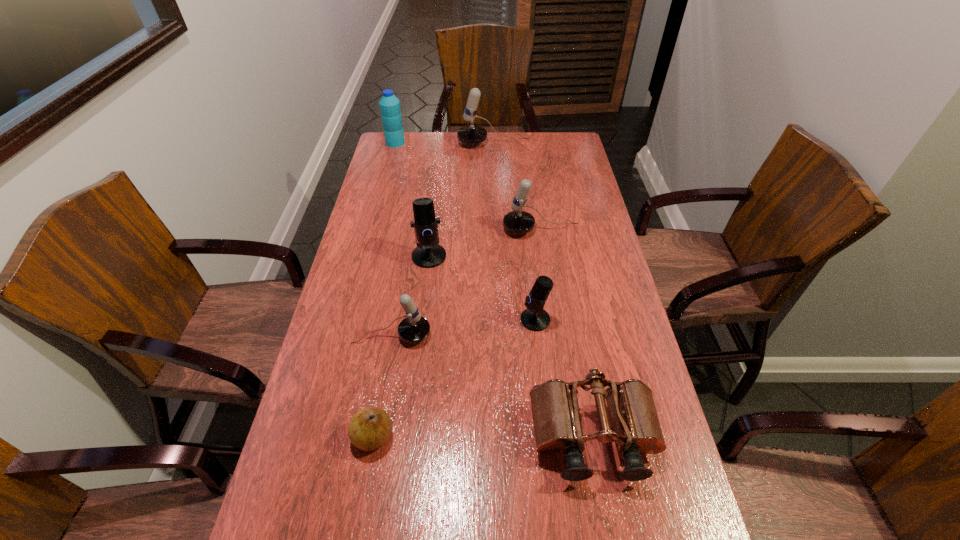
Identify the location of the farthest white microphone. This screenshot has width=960, height=540. (471, 134).

This screenshot has width=960, height=540. Identify the location of the biggest white microphone. (471, 134).

Where is `blue water bottle`? The image size is (960, 540). blue water bottle is located at coordinates (390, 109).

Locate an element on the screen. Image resolution: width=960 pixels, height=540 pixels. the left black microphone is located at coordinates (428, 254).

You are a GUI agent. You are given a task and a screenshot of the screen. Output one action in this format:
    pyautogui.click(x=<x>, y=<y>)
    Task: Click on the third farthest microphone
    Image resolution: width=960 pixels, height=540 pixels.
    Given the screenshot: What is the action you would take?
    pyautogui.click(x=428, y=254)

Find the location of a particular element. The width and height of the screenshot is (960, 540). the second smallest white microphone is located at coordinates (517, 221).

This screenshot has width=960, height=540. I want to click on the fourth nearest microphone, so click(x=517, y=221).

Locate an element on the screen. the leftmost white microphone is located at coordinates (414, 328).

What are the coordinates of `the smallest white microphone` in the screenshot? It's located at (414, 328).

Where is `the right black microphone`? The image size is (960, 540). the right black microphone is located at coordinates (535, 318).